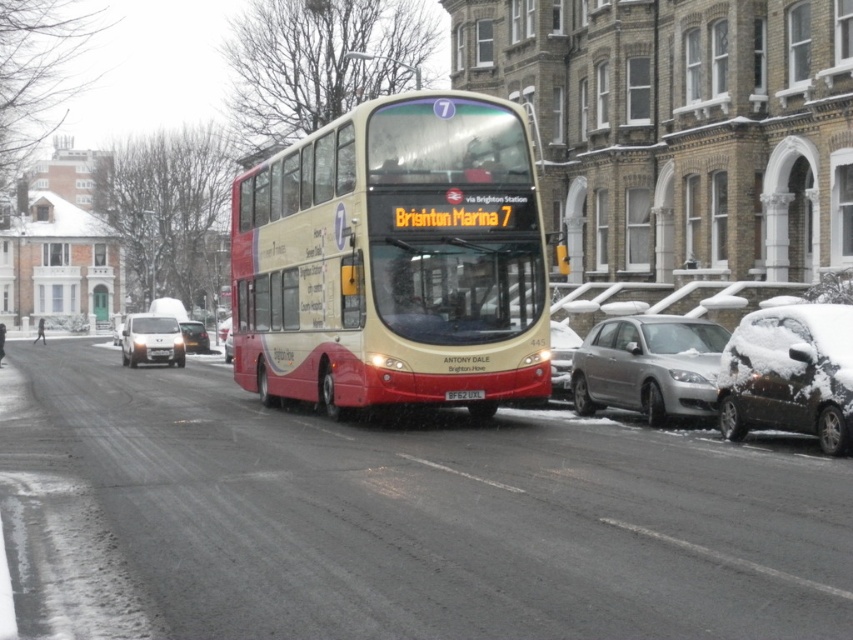
Question: Is beige matte double-decker bus at center wider than white plastic license plate at center?

Choices:
 (A) no
 (B) yes

Answer: (B)

Question: Which object appears closest to the camera in this image?

Choices:
 (A) white plastic license plate at center
 (B) metallic silver car at center
 (C) beige matte double-decker bus at center

Answer: (C)

Question: Does sleek silver sedan at center have a larger size compared to silver metallic license plate at center?

Choices:
 (A) no
 (B) yes

Answer: (B)

Question: Is silver metallic license plate at center in front of white plastic license plate at center?

Choices:
 (A) yes
 (B) no

Answer: (A)

Question: Estimate the real-world distances between objects in this image. Which object is farther from the satin silver van at left?

Choices:
 (A) silver metallic license plate at center
 (B) sleek silver sedan at center
 (C) beige matte double-decker bus at center

Answer: (A)

Question: Which object is farther from the camera taking this photo?

Choices:
 (A) silver metallic van at center
 (B) satin silver van at left
 (C) silver metallic sedan at lower right

Answer: (A)